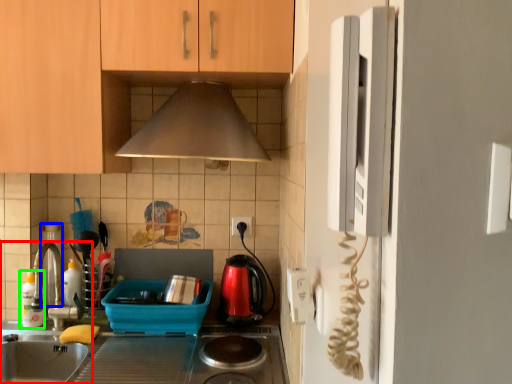
Question: Considering the real-world distances, which object is farthest from home appliance (highlighted by a red box)? appliance (highlighted by a blue box) or bottle (highlighted by a green box)?

Choices:
 (A) appliance
 (B) bottle

Answer: (A)